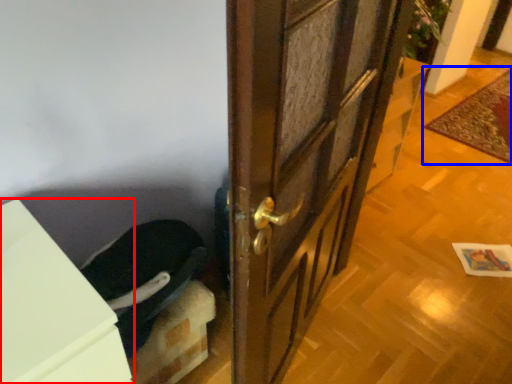
Question: Which object appears farthest to the camera in this image, cabinetry (highlighted by a red box) or doormat (highlighted by a blue box)?

Choices:
 (A) cabinetry
 (B) doormat

Answer: (B)